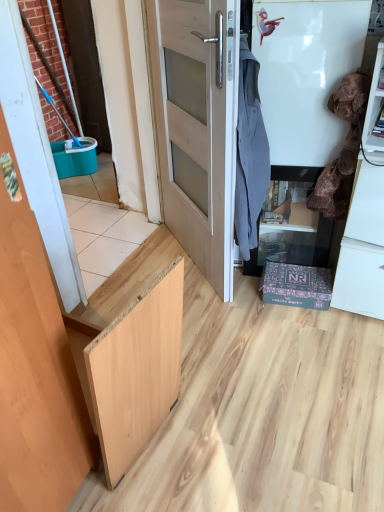
Locate an element on the screen. This screenshot has height=512, width=384. free space in front of light wood door at center, which is counted as the 2th door, starting from the left is located at coordinates (231, 326).